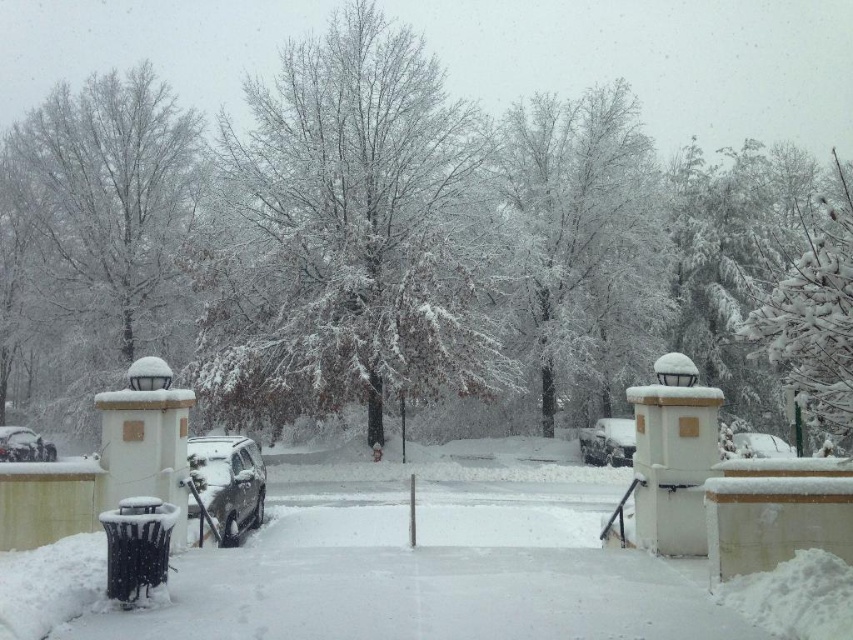
Question: Does snow-covered tree at left have a greater width compared to white snow-covered tree at upper right?

Choices:
 (A) yes
 (B) no

Answer: (B)

Question: Which object appears closest to the camera in this image?

Choices:
 (A) shiny silver car at lower left
 (B) snow-covered branches at center
 (C) snow-covered tree at left
 (D) sleek silver sedan at center

Answer: (C)

Question: Among these objects, which one is farthest from the camera?

Choices:
 (A) shiny silver car at lower left
 (B) white snow-covered tree at upper right
 (C) sleek silver sedan at center

Answer: (C)

Question: Is snow-covered tree at center below white snow-covered tree at upper right?

Choices:
 (A) no
 (B) yes

Answer: (A)

Question: From the image, what is the correct spatial relationship of sleek silver sedan at center in relation to shiny silver car at lower left?

Choices:
 (A) above
 (B) below

Answer: (A)

Question: Estimate the real-world distances between objects in this image. Which object is closer to the sleek silver sedan at center?

Choices:
 (A) snow-covered tree at center
 (B) snow-covered tree at left
 (C) sleek silver car at center

Answer: (A)